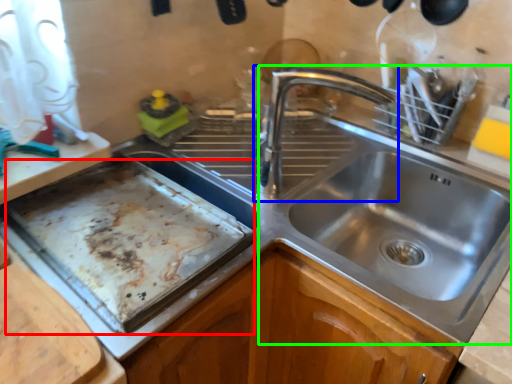
Question: Estimate the real-world distances between objects in this image. Which object is closer to baking sheet (highlighted by a red box), tap (highlighted by a blue box) or sink (highlighted by a green box)?

Choices:
 (A) tap
 (B) sink

Answer: (A)